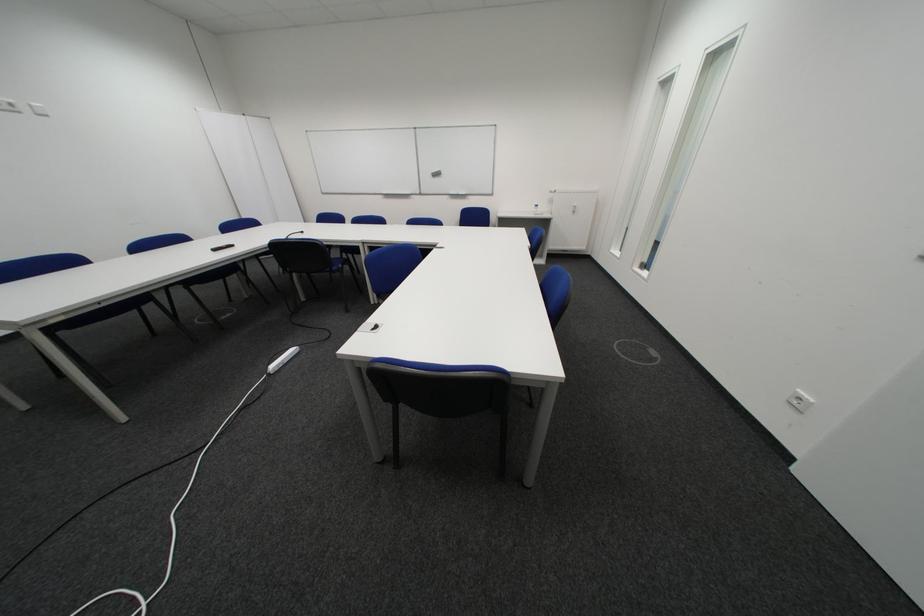
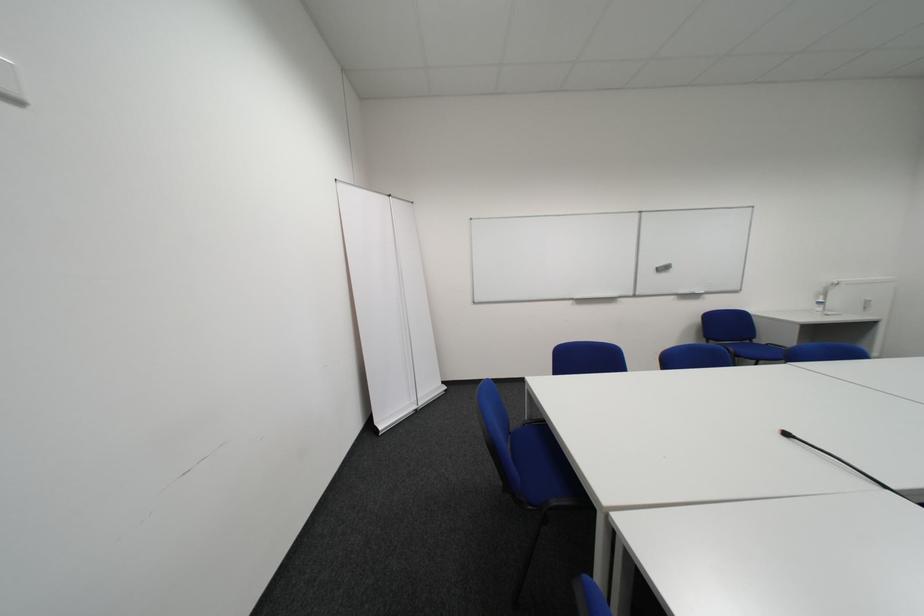
Locate, in the second image, the point that corresponds to point 444,175 in the first image.

(669, 270)